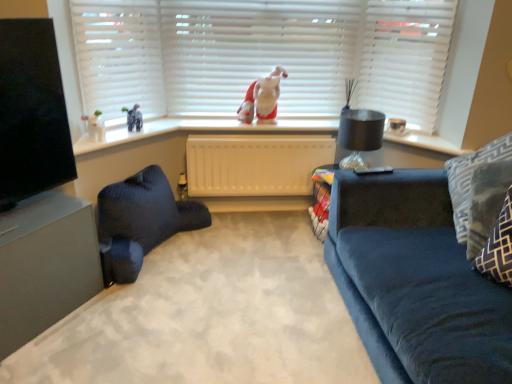
The image size is (512, 384). Find the location of `vacant space underneath black matte tv at left (from a real-world perspective)`. vacant space underneath black matte tv at left (from a real-world perspective) is located at coordinates pyautogui.click(x=34, y=206).